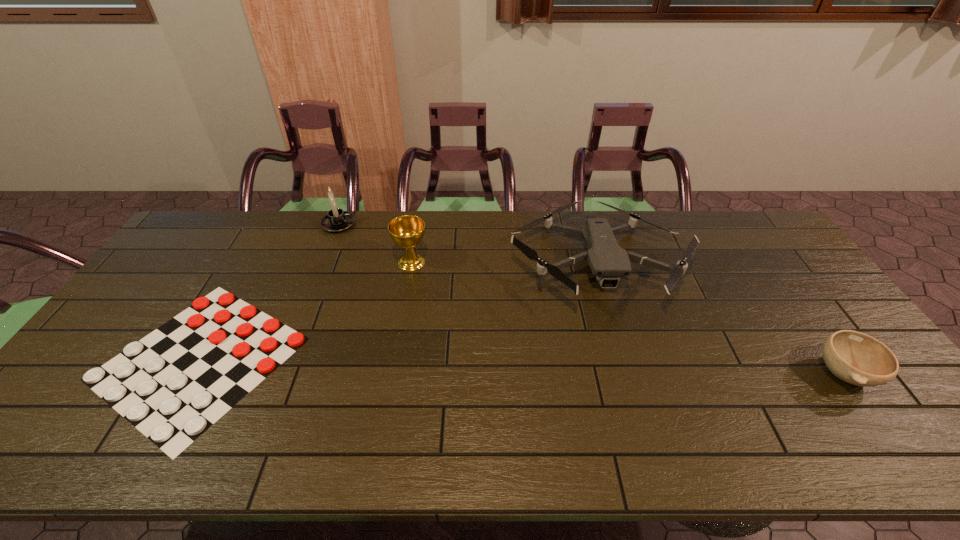
I want to click on free space at the near edge of the desktop, so click(774, 427).

In order to click on vacant space at the right edge of the desktop in this screenshot , I will do `click(794, 292)`.

The image size is (960, 540). Find the location of `free space at the far left corner of the desktop`. free space at the far left corner of the desktop is located at coordinates (241, 218).

Where is `free space between the shortest object and the second shortest object`? The image size is (960, 540). free space between the shortest object and the second shortest object is located at coordinates point(522,366).

Locate an element on the screen. free space between the candle holder and the checkerboard is located at coordinates click(x=269, y=292).

Where is `vacant space that is in between the fourth tallest object and the checkerboard`? The height and width of the screenshot is (540, 960). vacant space that is in between the fourth tallest object and the checkerboard is located at coordinates (522, 366).

This screenshot has height=540, width=960. What are the coordinates of `vacant space that is in between the fourth object from left to right and the chalice` in the screenshot? It's located at tap(504, 263).

The height and width of the screenshot is (540, 960). I want to click on free space that is in between the third object from left to right and the checkerboard, so click(x=305, y=310).

Find the location of a particular element. vacant space in between the chalice and the drone is located at coordinates (504, 263).

Identify the location of empty space between the bowl and the chalice. (628, 318).